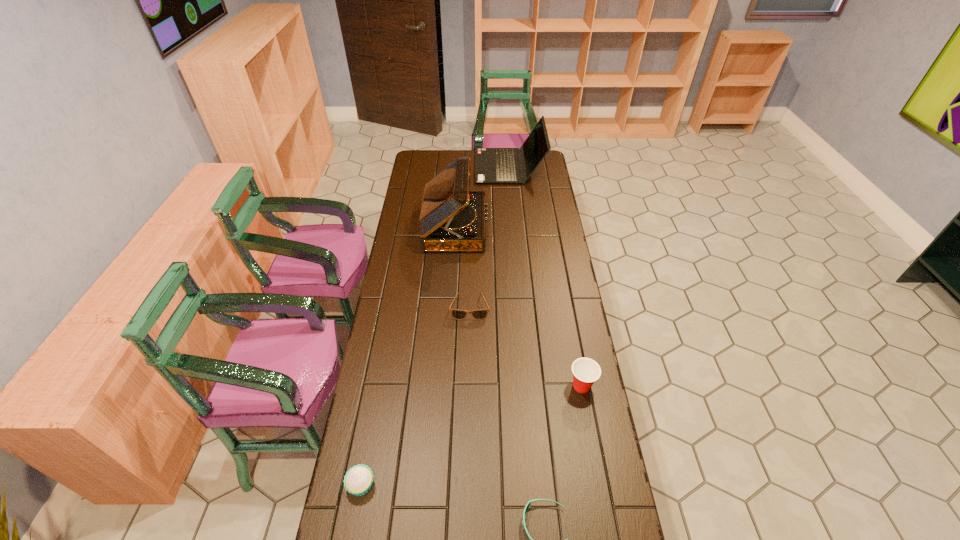
Identify the location of the second farthest object. This screenshot has height=540, width=960. (452, 218).

Locate an element on the screen. This screenshot has width=960, height=540. the tallest object is located at coordinates point(452,218).

I want to click on laptop computer, so click(492, 165).

Where is `the farthest object`? The image size is (960, 540). the farthest object is located at coordinates (492, 165).

Identify the location of cup. (586, 371).

Where is `the leftmost object`? This screenshot has width=960, height=540. the leftmost object is located at coordinates (358, 480).

Where is `the second nearest object`? the second nearest object is located at coordinates (358, 480).

You are a GUI agent. You are given a task and a screenshot of the screen. Output one action in this format:
    pyautogui.click(x=<x>, y=<y>)
    Task: Click on the fifth tallest object
    The height and width of the screenshot is (540, 960).
    Given the screenshot: What is the action you would take?
    pyautogui.click(x=457, y=314)

I want to click on the left sunglasses, so click(457, 314).

Locate an element on the screen. vacant space located 0.250m on the front-facing side of the tallest object is located at coordinates (540, 227).